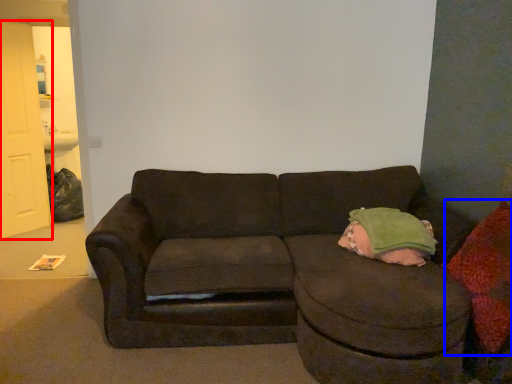
Question: Among these objects, which one is nearest to the camera, door (highlighted by a red box) or throw pillow (highlighted by a blue box)?

Choices:
 (A) door
 (B) throw pillow

Answer: (B)